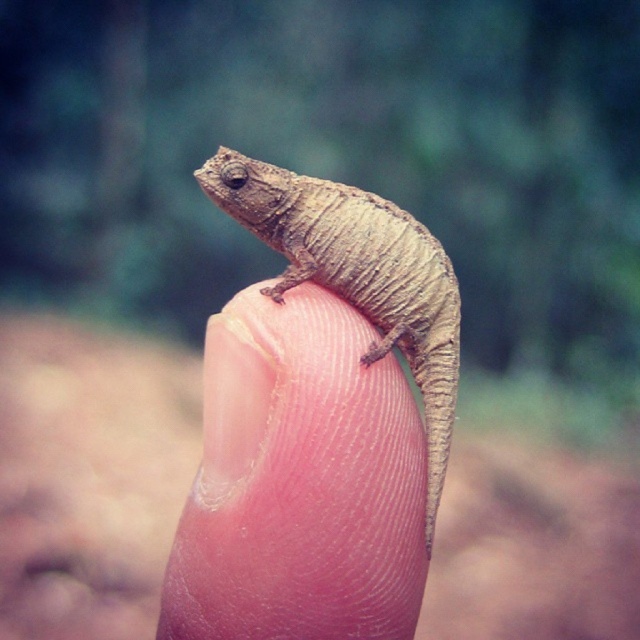
Question: Does brown rough skin at center have a greater width compared to brown textured lizard at center?

Choices:
 (A) yes
 (B) no

Answer: (B)

Question: Is brown rough skin at center to the right of brown textured lizard at center from the viewer's perspective?

Choices:
 (A) no
 (B) yes

Answer: (A)

Question: Among these points, which one is nearest to the camera?

Choices:
 (A) (300, 397)
 (B) (275, 294)

Answer: (A)

Question: Which point is farther from the camera taking this photo?

Choices:
 (A) (403, 314)
 (B) (385, 360)

Answer: (A)

Question: Does brown rough skin at center appear over brown textured lizard at center?

Choices:
 (A) yes
 (B) no

Answer: (B)